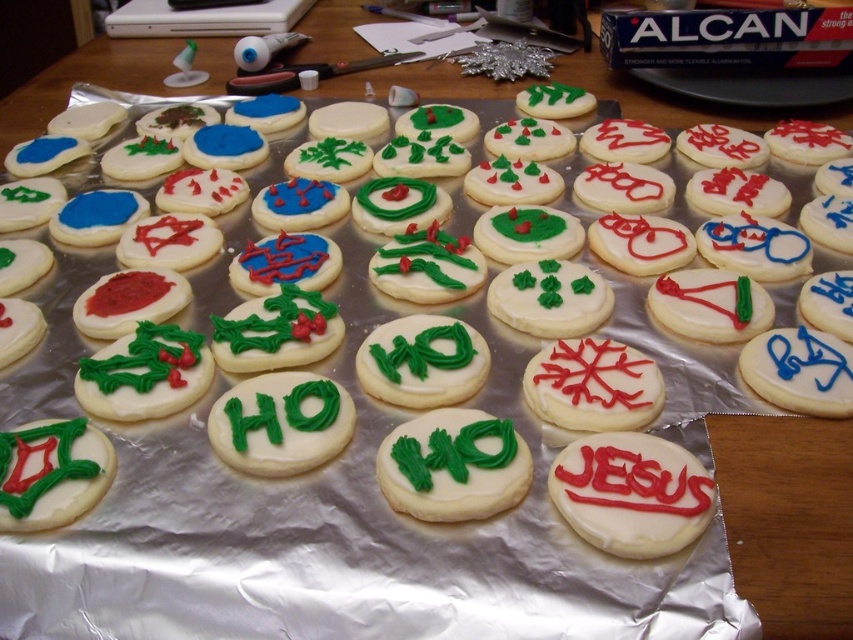
Question: Among these objects, which one is nearest to the camera?

Choices:
 (A) green frosting cookie at center
 (B) green frosted cookie with white icing at center
 (C) white smooth cookie at center

Answer: (B)

Question: Is green frosted cookie with white icing at center positioned before green frosting cookie at center?

Choices:
 (A) no
 (B) yes

Answer: (B)

Question: Among these points, which one is nearest to the camera?

Choices:
 (A) (262, 380)
 (B) (494, 515)

Answer: (B)

Question: From the image, what is the correct spatial relationship of green frosted cookie with white icing at center in relation to green frosting cookie at center?

Choices:
 (A) above
 (B) below

Answer: (B)

Question: Which point is closer to the camera?

Choices:
 (A) (479, 424)
 (B) (810, 268)
 (C) (310, 424)

Answer: (A)

Question: Does green frosted cookie with white icing at center have a greater width compared to green frosting cookie at center?

Choices:
 (A) no
 (B) yes

Answer: (A)